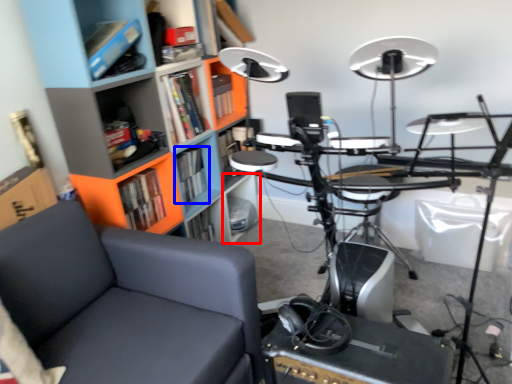
Question: Among these objects, which one is nearest to the camera, shelf (highlighted by a red box) or book (highlighted by a blue box)?

Choices:
 (A) shelf
 (B) book

Answer: (B)